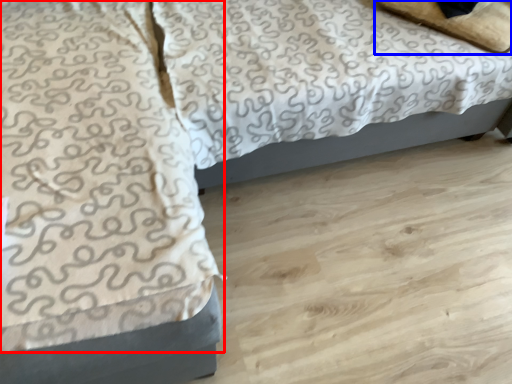
Question: Which object is further to the camera taking this photo, blanket (highlighted by a red box) or pillow (highlighted by a blue box)?

Choices:
 (A) blanket
 (B) pillow

Answer: (B)